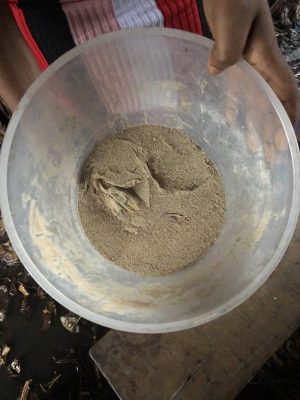
I want to click on glass bowl, so click(265, 156).